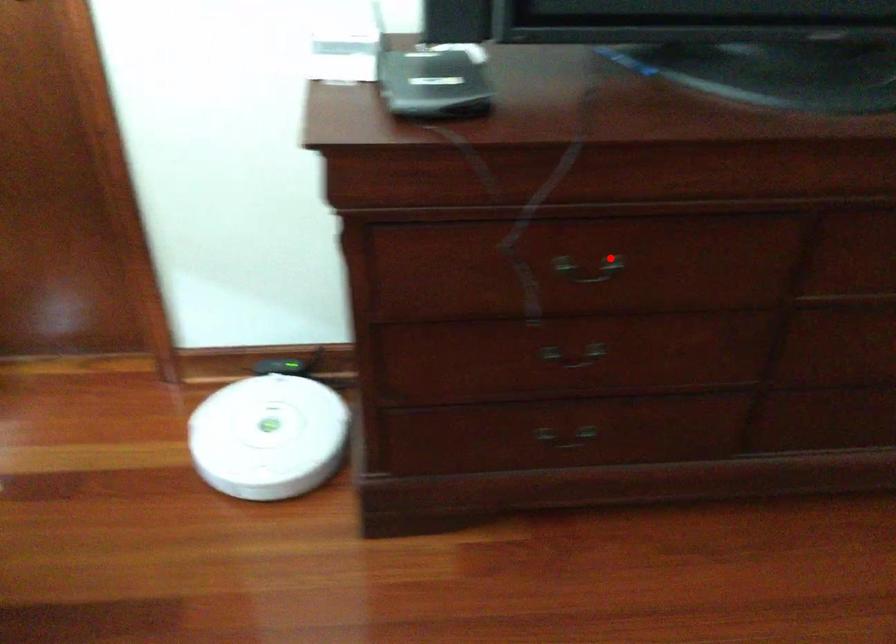
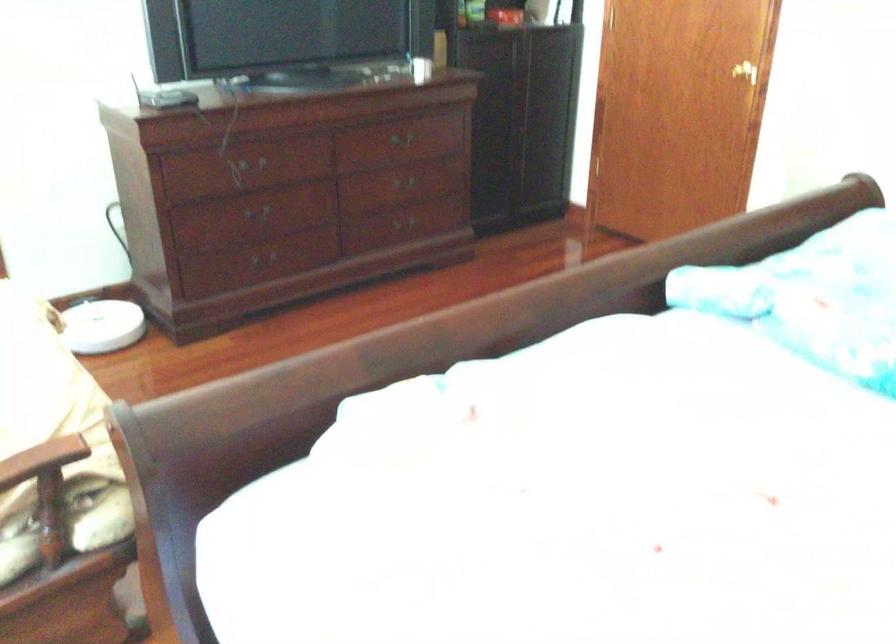
Question: I am providing you with two images of the same scene from different viewpoints. Given a red point in image1, look at the same physical point in image2. Is it:

Choices:
 (A) Closer to the viewpoint
 (B) Farther from the viewpoint

Answer: (B)